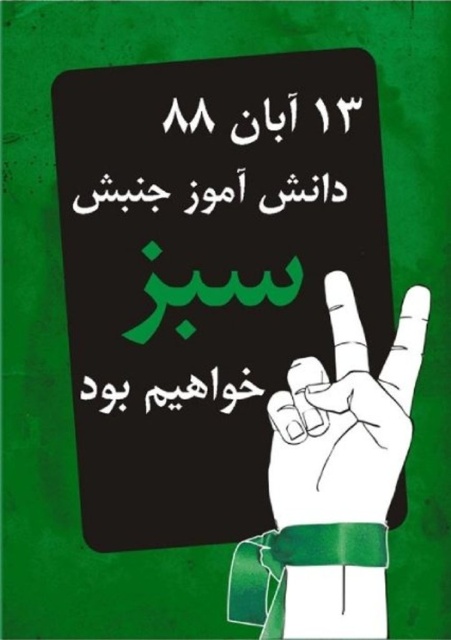
You are an observer looking at the image. There are two points marked in the image. The first point is at coordinates point [359,339] and the second point is at point [151,401]. Which point is closer to you?

Point [359,339] is closer to the camera than point [151,401].

You are an artist trying to create a similar design. You have a white paper hand at center and a black paper at center. Which object should you place first to ensure proper alignment based on their sizes?

Since the white paper hand at center is narrower than the black paper at center, you should place the black paper at center first to ensure proper alignment.